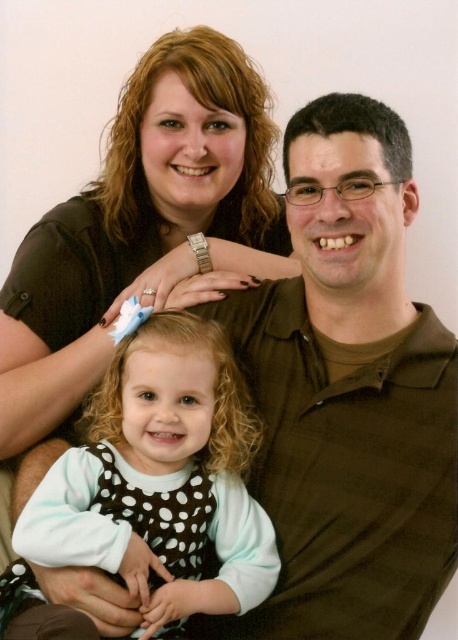
Question: Which object appears closest to the camera in this image?

Choices:
 (A) matte black shirt at upper left
 (B) white dotted dress at center

Answer: (B)

Question: From the image, what is the correct spatial relationship of matte black shirt at upper left in relation to white dotted dress at center?

Choices:
 (A) above
 (B) below

Answer: (A)

Question: Is matte black shirt at upper left above white dotted dress at center?

Choices:
 (A) yes
 (B) no

Answer: (A)

Question: Among these points, which one is nearest to the camera?

Choices:
 (A) (136, 202)
 (B) (245, 492)

Answer: (B)

Question: Which object appears closest to the camera in this image?

Choices:
 (A) matte black shirt at upper left
 (B) white dotted dress at center

Answer: (B)

Question: Does matte black shirt at upper left appear on the right side of white dotted dress at center?

Choices:
 (A) no
 (B) yes

Answer: (A)